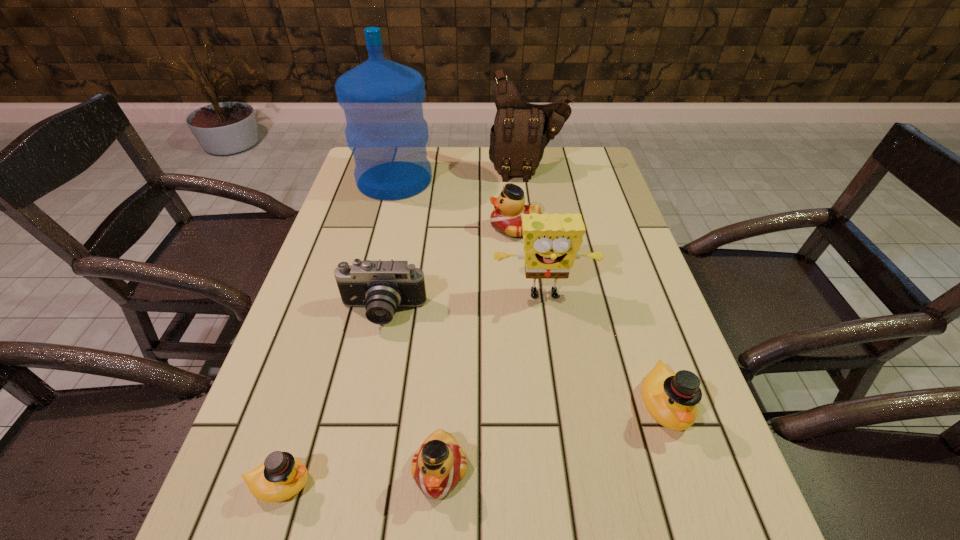
Locate an element on the screen. Image resolution: width=960 pixels, height=540 pixels. free space that satisfies the following two spatial constraints: 1. on the face of the fifth object from right to left; 2. on the front-facing side of the nearer yellow duck is located at coordinates (439, 484).